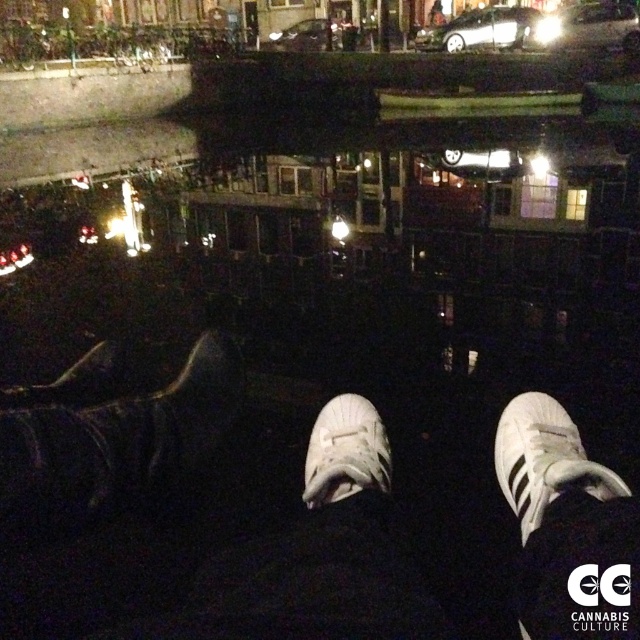
You are standing on a bridge at night and see your white synthetic sneakers at center reflected in the water below. If you move your feet forward by 0.1 units in the x and y direction, will your sneakers still be visible in the reflection?

The white synthetic sneakers at center is located at point (177, 531). Moving forward by 0.1 units in both x and y directions would place them at approximately (241, 595). Since the reflection covers the area below the bridge, it is likely the sneakers would still be visible as they remain within the reflective surface.

You are standing on a bridge at night and notice two shoes at the center of your view. The white synthetic sneakers at center and the white matte shoe at center. Which one appears bigger in size?

The white synthetic sneakers at center has a larger size compared to the white matte shoe at center, so the white synthetic sneakers at center appears bigger.

You are standing on a bridge at night and see your white synthetic sneakers at center. If you drop a small pebble from your sneakers, where will it land relative to the reflective surface below?

The reflective surface is directly below the white synthetic sneakers at center, so the pebble will land on the reflective surface.